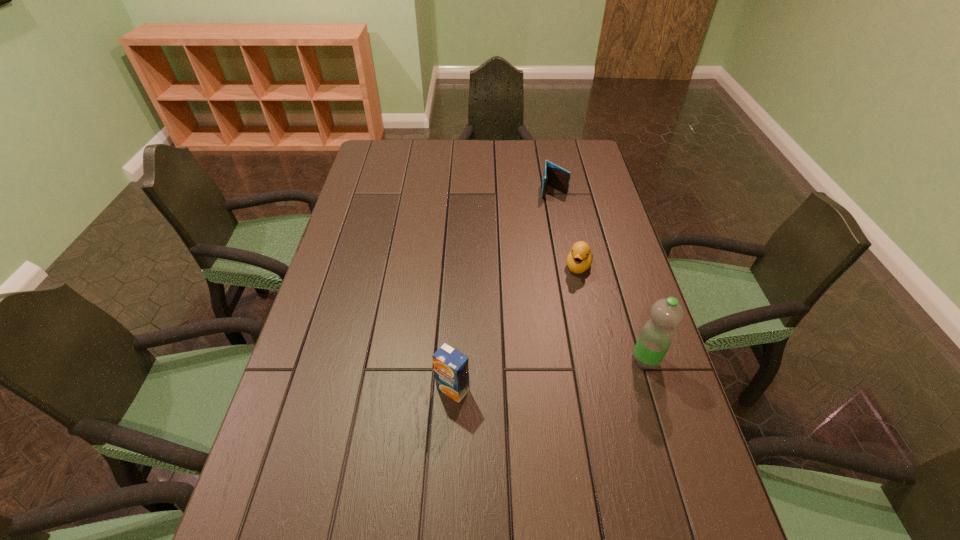
I want to click on the second tallest object, so click(451, 368).

Where is `orange_juice`? The image size is (960, 540). orange_juice is located at coordinates coord(451,368).

Find the location of a particular element. The height and width of the screenshot is (540, 960). the rightmost object is located at coordinates 656,336.

Identify the location of water bottle. (656, 336).

Locate an element on the screen. The image size is (960, 540). wallet is located at coordinates (558, 178).

This screenshot has height=540, width=960. Find the location of `the third nearest object`. the third nearest object is located at coordinates (579, 259).

You are a GUI agent. You are given a task and a screenshot of the screen. Output one action in this format:
    pyautogui.click(x=<x>, y=<y>)
    Task: Click on the vacant space located on the left of the nearest object
    The width and height of the screenshot is (960, 540).
    Given the screenshot: What is the action you would take?
    pyautogui.click(x=360, y=389)

The image size is (960, 540). I want to click on vacant space located on the front of the second nearest object, so click(664, 423).

The width and height of the screenshot is (960, 540). In order to click on vacant position located 0.310m on the exterior surface of the farthest object in this screenshot , I will do `click(553, 260)`.

The image size is (960, 540). I want to click on vacant position located on the exterior surface of the farthest object, so click(553, 257).